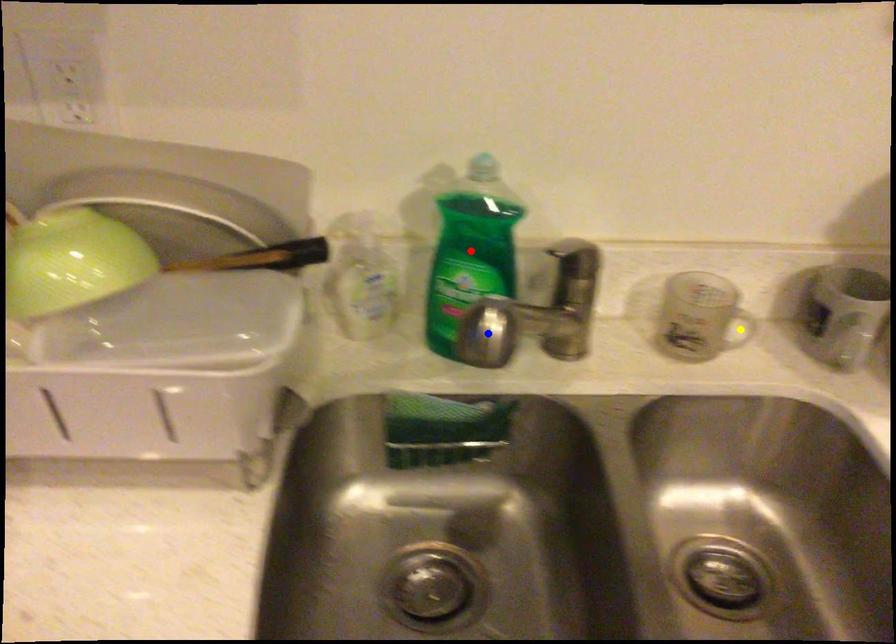
Order these from nearest to farthest:
red point | blue point | yellow point

blue point
red point
yellow point